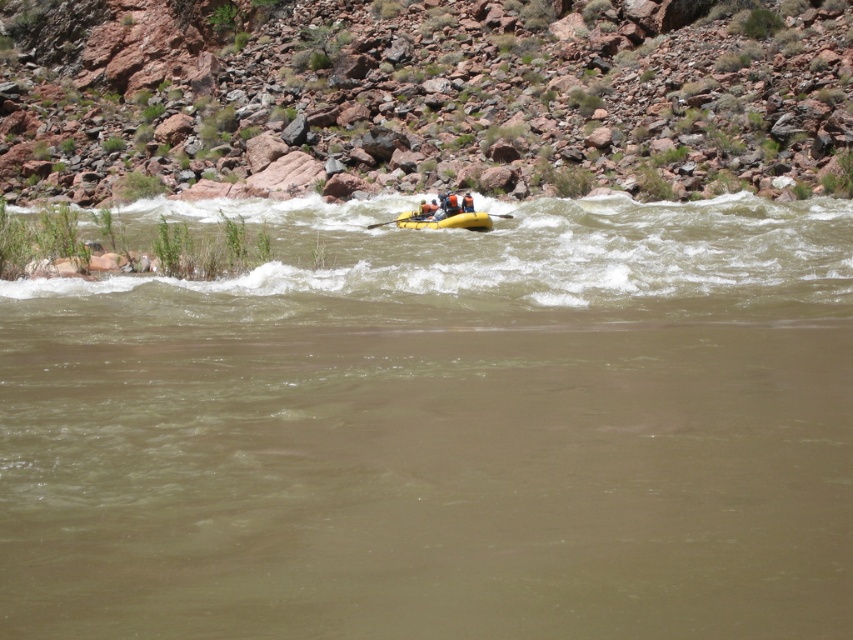
You are standing at the origin point in the river scene. There are two points marked in the image, point A at coordinates point A is point (412, 221) and point B is point (469, 205). Which point is closer to you?

Point B is closer to you because point A is behind point B.

You are a photographer trying to capture the raft and boat in the river scene. Since both the brown rubber raft at center and the yellow rubber boat at center are in the center, which one is more to the right?

The brown rubber raft at center is positioned on the right side of the yellow rubber boat at center, so it is more to the right.

You are a photographer trying to capture the yellow rubber boat at center and the yellow rubber paddle at center in the same frame. Which object should you focus on first to ensure both are in sharp focus?

You should focus on the yellow rubber boat at center first because it is closer to the viewer than the yellow rubber paddle at center. By focusing on the closer object, the paddle will also be in focus due to the depth of field.